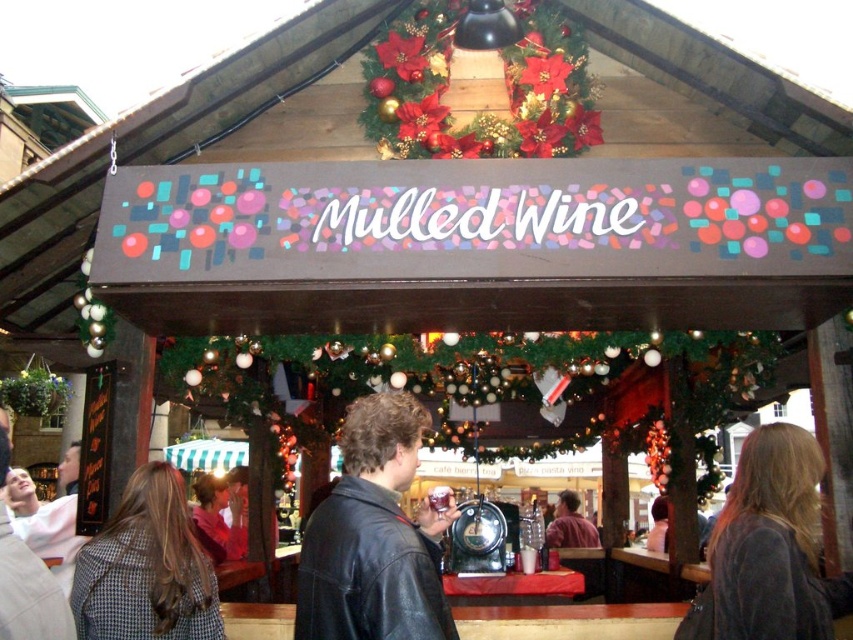
Question: Does red velvet wreath at upper center appear on the left side of matte brown leather jacket at center?

Choices:
 (A) yes
 (B) no

Answer: (A)

Question: Does red velvet wreath at upper center appear on the left side of matte brown leather jacket at center?

Choices:
 (A) yes
 (B) no

Answer: (A)

Question: Estimate the real-world distances between objects in this image. Which object is closer to the red velvet wreath at upper center?

Choices:
 (A) matte brown leather jacket at center
 (B) leather jacket at center

Answer: (B)

Question: Which object is closer to the camera taking this photo?

Choices:
 (A) leather jacket at center
 (B) matte brown leather jacket at center
 (C) red velvet wreath at upper center

Answer: (A)

Question: Among these points, which one is farthest from the camera?

Choices:
 (A) click(538, 60)
 (B) click(341, 627)
 (C) click(596, 541)

Answer: (C)

Question: Does leather jacket at center have a larger size compared to red velvet wreath at upper center?

Choices:
 (A) no
 (B) yes

Answer: (B)